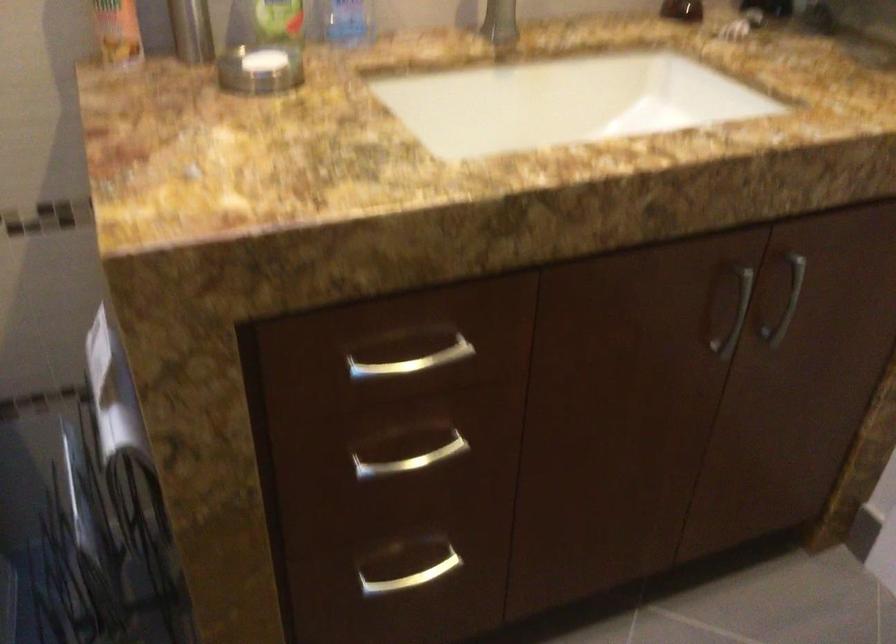
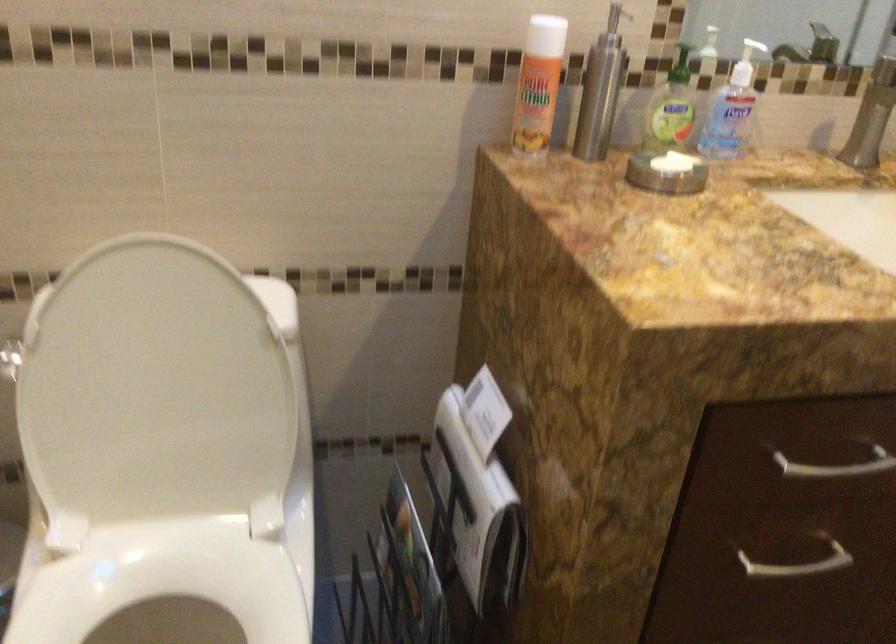
Where in the second image is the point corresponding to [251,71] from the first image?

(667, 172)